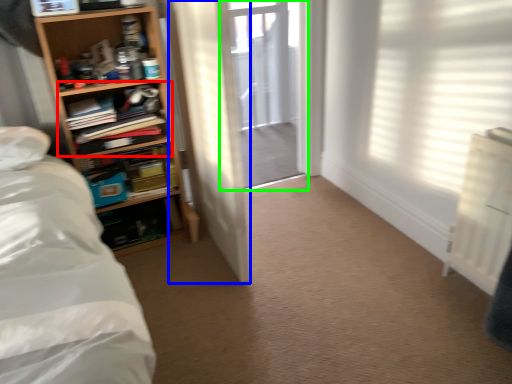
Question: Estimate the real-world distances between objects in this image. Which object is farther from shelf (highlighted by a red box), door (highlighted by a blue box) or screen door (highlighted by a green box)?

Choices:
 (A) door
 (B) screen door

Answer: (B)